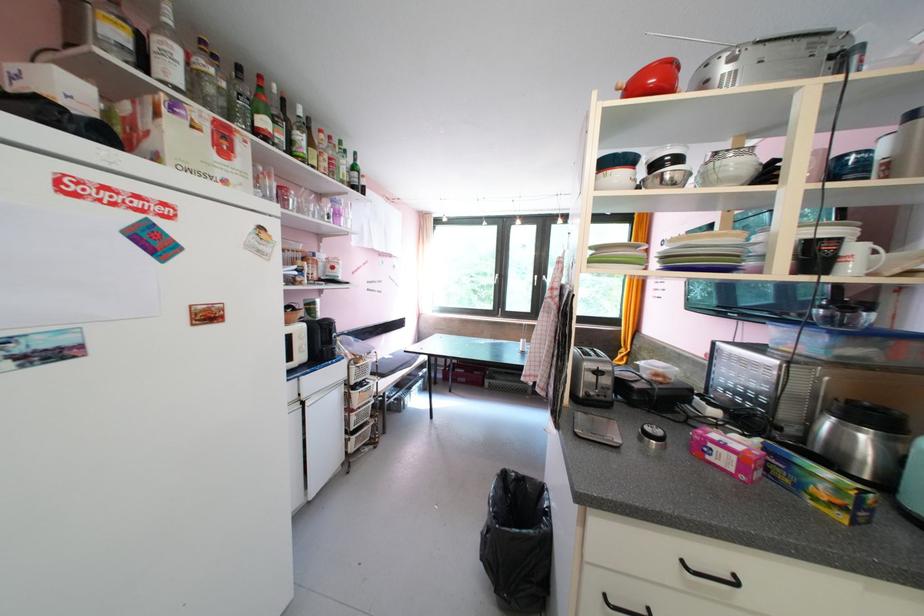
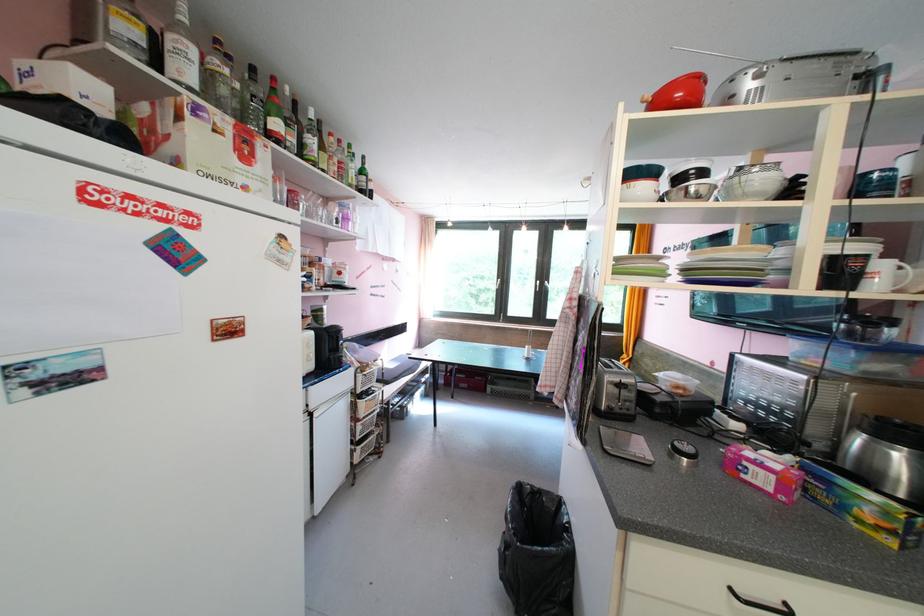
Question: Based on the continuous images, in which direction is the camera rotating? Reply with the corresponding letter.

Choices:
 (A) Left
 (B) Right
 (C) Up
 (D) Down

Answer: (B)